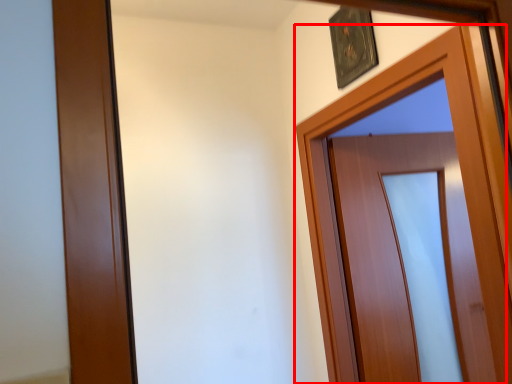
Question: From the image's perspective, what is the correct spatial positioning of door (annotated by the red box) in reference to picture frame?

Choices:
 (A) above
 (B) below

Answer: (B)